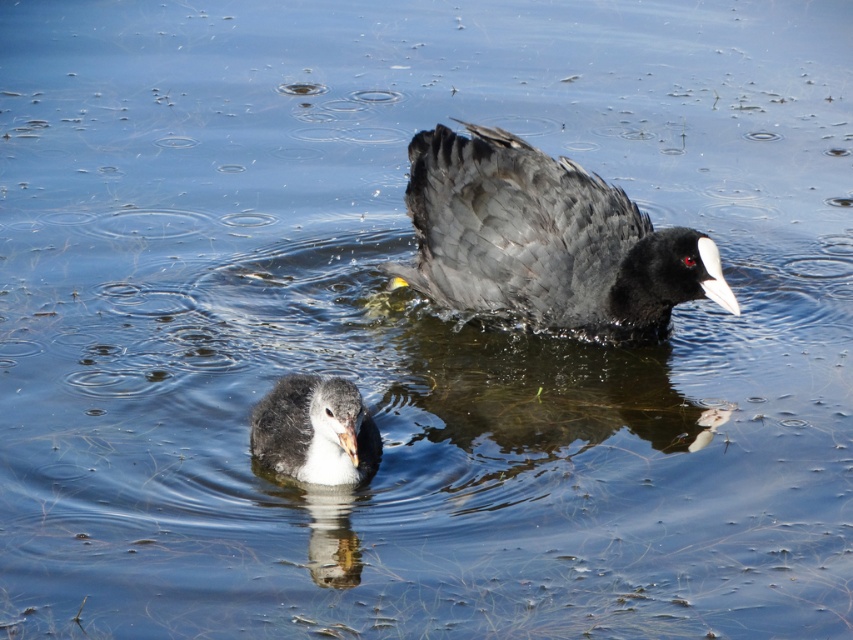
Question: From the image, what is the correct spatial relationship of matte black duck at center in relation to gray downy duckling at center?

Choices:
 (A) left
 (B) right

Answer: (B)

Question: Can you confirm if matte black duck at center is positioned to the left of gray downy duckling at center?

Choices:
 (A) no
 (B) yes

Answer: (A)

Question: Among these objects, which one is nearest to the camera?

Choices:
 (A) gray downy duckling at center
 (B) matte black duck at center

Answer: (A)

Question: Does matte black duck at center appear on the left side of gray downy duckling at center?

Choices:
 (A) no
 (B) yes

Answer: (A)